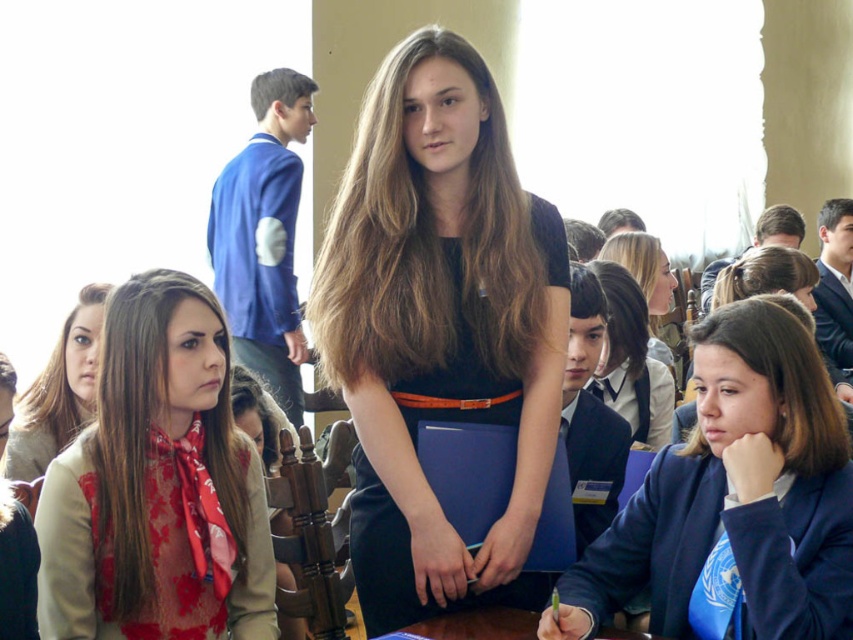
Question: Which point appears farthest from the camera in this image?

Choices:
 (A) (498, 189)
 (B) (7, 460)

Answer: (A)

Question: Can you confirm if blue fabric jacket at center is wider than light brown hair at lower left?

Choices:
 (A) no
 (B) yes

Answer: (A)

Question: Can you confirm if matte black dress at center is smaller than light brown hair at lower left?

Choices:
 (A) no
 (B) yes

Answer: (A)

Question: Which object appears farthest from the camera in this image?

Choices:
 (A) light brown hair at lower left
 (B) matte black dress at center

Answer: (B)

Question: Can you confirm if light brown hair at lower left is positioned below smooth blonde hair at center?

Choices:
 (A) no
 (B) yes

Answer: (B)

Question: Which point appears farthest from the camera in this image?

Choices:
 (A) (612, 592)
 (B) (254, 461)

Answer: (B)